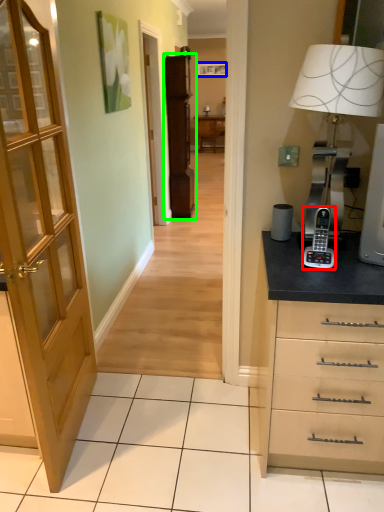
Question: Estimate the real-world distances between objects in this image. Which object is closer to gadget (highlighted by a red box), picture frame (highlighted by a blue box) or file cabinet (highlighted by a green box)?

Choices:
 (A) picture frame
 (B) file cabinet

Answer: (B)